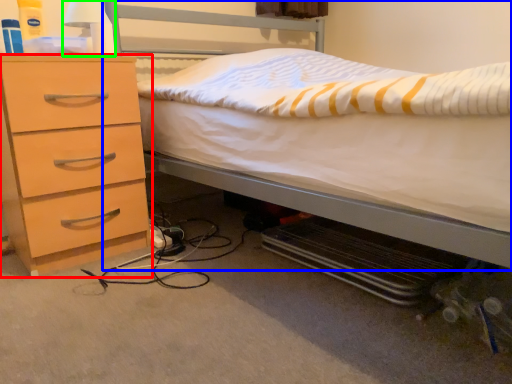
Question: Estimate the real-world distances between objects in this image. Which object is farther from chest of drawers (highlighted by a red box), bed (highlighted by a blue box) or bedside lamp (highlighted by a green box)?

Choices:
 (A) bed
 (B) bedside lamp

Answer: (A)